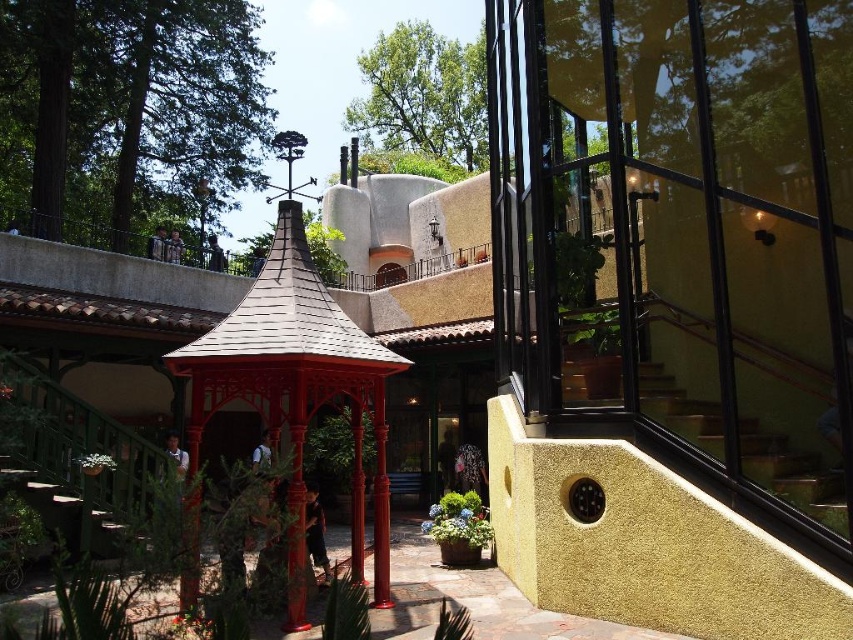
Who is shorter, green leafy tree at upper left or matte red gazebo at center?

Standing shorter between the two is matte red gazebo at center.

This screenshot has height=640, width=853. What are the coordinates of `green leafy tree at upper left` in the screenshot? It's located at (131, 108).

Find the location of a particular element. The width and height of the screenshot is (853, 640). green leafy tree at upper left is located at coordinates (131, 108).

Between green leafy tree at upper left and green leafy tree at upper center, which one has less height?

Standing shorter between the two is green leafy tree at upper left.

From the picture: Which is more to the left, green leafy tree at upper left or green leafy tree at upper center?

green leafy tree at upper left is more to the left.

Who is more distant from viewer, (140, 3) or (426, 138)?

The point (426, 138) is more distant.

Locate an element on the screen. green leafy tree at upper left is located at coordinates point(131,108).

Does point (314, 372) come closer to viewer compared to point (366, 106)?

Yes, point (314, 372) is in front of point (366, 106).

Does matte red gazebo at center appear under green leafy tree at upper center?

Correct, matte red gazebo at center is located below green leafy tree at upper center.

Measure the distance between point (383, 355) and camera.

A distance of 26.75 feet exists between point (383, 355) and camera.

Find the location of a particular element. This screenshot has width=853, height=640. matte red gazebo at center is located at coordinates (296, 388).